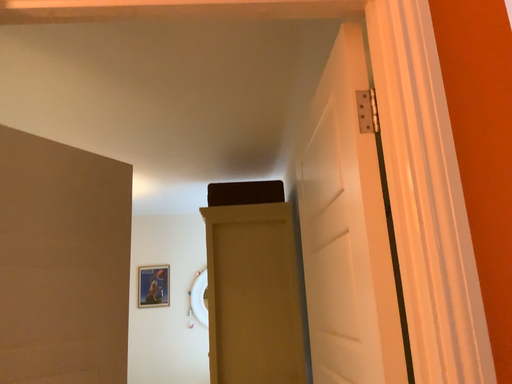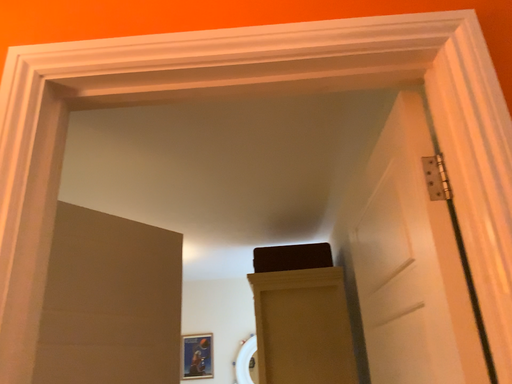
Question: How did the camera likely rotate when shooting the video?

Choices:
 (A) rotated upward
 (B) rotated downward

Answer: (A)